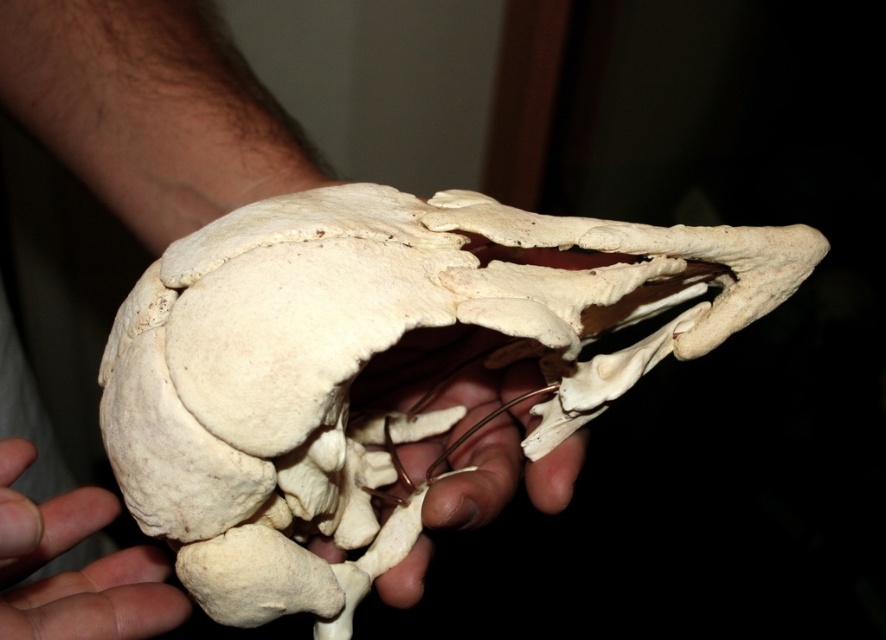
Which is below, white bone skull at center or white matte bone at center?

white matte bone at center

Identify the location of white bone skull at center. Image resolution: width=886 pixels, height=640 pixels. (368, 362).

Find the location of a particular element. Image resolution: width=886 pixels, height=640 pixels. white bone skull at center is located at coordinates (368, 362).

Find the location of a particular element. white bone skull at center is located at coordinates (368, 362).

The width and height of the screenshot is (886, 640). What are the coordinates of `white matte bone at center` in the screenshot? It's located at (443, 385).

The width and height of the screenshot is (886, 640). Describe the element at coordinates (443, 385) in the screenshot. I see `white matte bone at center` at that location.

What are the coordinates of `white matte bone at center` in the screenshot? It's located at (443, 385).

The width and height of the screenshot is (886, 640). Describe the element at coordinates (368, 362) in the screenshot. I see `white bone skull at center` at that location.

Is point (324, 269) less distant than point (140, 554)?

That is True.

Locate an element on the screen. white bone skull at center is located at coordinates (368, 362).